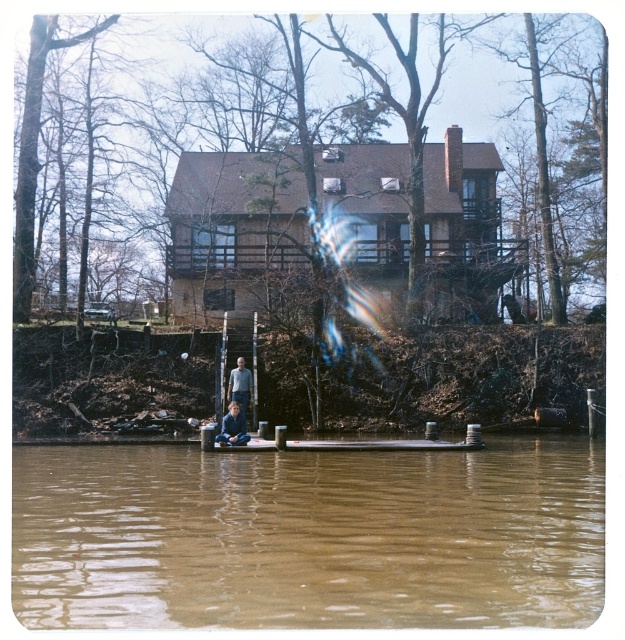
Question: Which is nearer to the brown muddy water at lower center?

Choices:
 (A) dark blue sweater at center
 (B) light blue jeans at lower center

Answer: (A)

Question: In this image, where is brown muddy water at lower center located relative to dark blue sweater at center?

Choices:
 (A) right
 (B) left

Answer: (A)

Question: Which point appears farthest from the camera in this image?

Choices:
 (A) (246, 381)
 (B) (116, 472)
 (C) (226, 433)

Answer: (A)

Question: Where is dark blue sweater at center located in relation to light blue jeans at lower center in the image?

Choices:
 (A) left
 (B) right

Answer: (B)

Question: Which point is farther from the camera taking this photo?

Choices:
 (A) (230, 442)
 (B) (496, 531)

Answer: (A)

Question: Considering the relative positions of brown muddy water at lower center and dark blue sweater at center in the image provided, where is brown muddy water at lower center located with respect to dark blue sweater at center?

Choices:
 (A) above
 (B) below

Answer: (B)